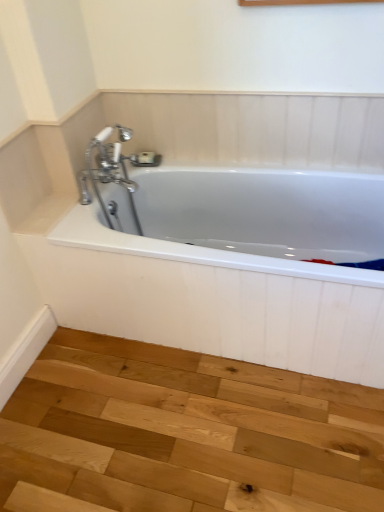
Where is `natural wood stair at lower left`? This screenshot has height=512, width=384. natural wood stair at lower left is located at coordinates (184, 434).

This screenshot has height=512, width=384. What do you see at coordinates (184, 434) in the screenshot?
I see `natural wood stair at lower left` at bounding box center [184, 434].

This screenshot has width=384, height=512. I want to click on white glossy bathtub at center, so point(237,267).

The image size is (384, 512). What do you see at coordinates (237, 267) in the screenshot?
I see `white glossy bathtub at center` at bounding box center [237, 267].

In order to face white glossy bathtub at center, should I rotate leftwards or rightwards?

Turn right by 3.849 degrees to look at white glossy bathtub at center.

Image resolution: width=384 pixels, height=512 pixels. Find the location of `natural wood stair at lower left`. natural wood stair at lower left is located at coordinates (184, 434).

Would you say natural wood stair at lower left is to the left or to the right of white glossy bathtub at center in the picture?

In the image, natural wood stair at lower left appears on the left side of white glossy bathtub at center.

Which object is further away from the camera, natural wood stair at lower left or white glossy bathtub at center?

white glossy bathtub at center is further away from the camera.

Does point (48, 501) appear closer or farther from the camera than point (167, 328)?

Point (48, 501) is closer to the camera than point (167, 328).

Based on the photo, from the image's perspective, is natural wood stair at lower left over white glossy bathtub at center?

No, from the image's perspective, natural wood stair at lower left is not on top of white glossy bathtub at center.

Looking at this image, from a real-world perspective, which object stands above the other?

white glossy bathtub at center, from a real-world perspective.

Between natural wood stair at lower left and white glossy bathtub at center, which one has larger width?

natural wood stair at lower left is wider.

In the scene shown: Who is taller, natural wood stair at lower left or white glossy bathtub at center?

white glossy bathtub at center.

Who is bigger, natural wood stair at lower left or white glossy bathtub at center?

white glossy bathtub at center.

Would you say natural wood stair at lower left is outside white glossy bathtub at center?

Indeed, natural wood stair at lower left is completely outside white glossy bathtub at center.

Is there a large distance between natural wood stair at lower left and white glossy bathtub at center?

No.

Is white glossy bathtub at center at the back of natural wood stair at lower left?

No, natural wood stair at lower left's orientation is not away from white glossy bathtub at center.

How many degrees apart are the facing directions of natural wood stair at lower left and white glossy bathtub at center?

The facing directions of natural wood stair at lower left and white glossy bathtub at center are 89.8 degrees apart.

Locate an element on the screen. This screenshot has height=512, width=384. bathtub that is behind the natural wood stair at lower left is located at coordinates (237, 267).

Is white glossy bathtub at center at the left side of natural wood stair at lower left?

No.

Which object is more forward, white glossy bathtub at center or natural wood stair at lower left?

natural wood stair at lower left.

Which is closer, [360,371] or [290,458]?

The point [290,458] is more forward.

From the image's perspective, is white glossy bathtub at center above natural wood stair at lower left?

Yes, from the image's perspective, white glossy bathtub at center is on top of natural wood stair at lower left.

Looking at this image, from a real-world perspective, which is physically below, white glossy bathtub at center or natural wood stair at lower left?

natural wood stair at lower left, from a real-world perspective.

Which of these two, white glossy bathtub at center or natural wood stair at lower left, is thinner?

white glossy bathtub at center is thinner.

Who is shorter, white glossy bathtub at center or natural wood stair at lower left?

natural wood stair at lower left is shorter.

Is white glossy bathtub at center smaller than natural wood stair at lower left?

No, white glossy bathtub at center is not smaller than natural wood stair at lower left.

Is white glossy bathtub at center outside of natural wood stair at lower left?

That's correct, white glossy bathtub at center is outside of natural wood stair at lower left.

Would you say white glossy bathtub at center is a long distance from natural wood stair at lower left?

No.

Does white glossy bathtub at center turn towards natural wood stair at lower left?

Yes, white glossy bathtub at center faces towards natural wood stair at lower left.

How different are the orientations of white glossy bathtub at center and natural wood stair at lower left in degrees?

The angular difference between white glossy bathtub at center and natural wood stair at lower left is 89.8 degrees.

What are the coordinates of `stair below the white glossy bathtub at center (from the image's perspective)` in the screenshot? It's located at (184, 434).

At what (x,y) coordinates should I click in order to perform the action: click on stair in front of the white glossy bathtub at center. Please return your answer as a coordinate pair (x, y). Looking at the image, I should click on (184, 434).

The image size is (384, 512). In order to click on bathtub that is on the right side of natural wood stair at lower left in this screenshot , I will do `click(237, 267)`.